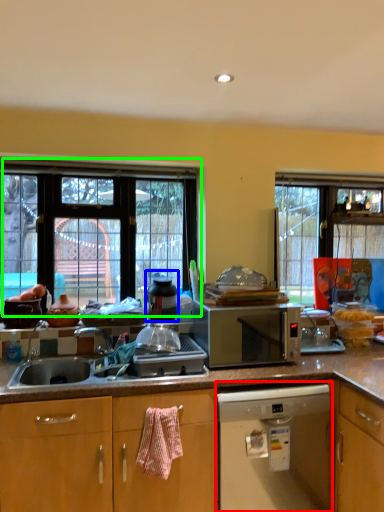
Question: Based on their relative distances, which object is nearer to home appliance (highlighted by a red box)? Choose from appliance (highlighted by a blue box) and window (highlighted by a green box).

Choices:
 (A) appliance
 (B) window

Answer: (A)